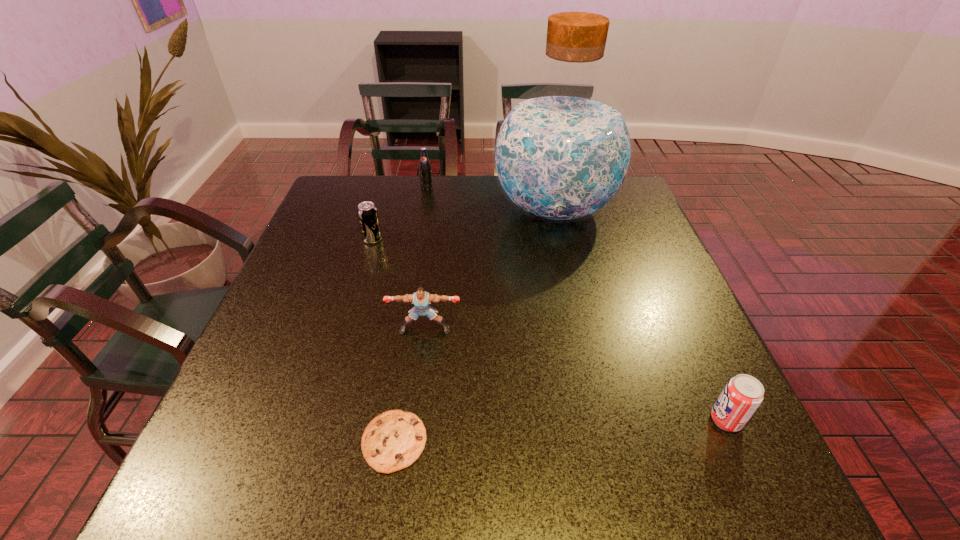
Identify the location of water jug. The image size is (960, 540). (562, 152).

I want to click on the tallest object, so click(562, 152).

The image size is (960, 540). In order to click on the second soda can from left to right in this screenshot , I will do `click(425, 169)`.

Locate an element on the screen. The width and height of the screenshot is (960, 540). the farthest soda can is located at coordinates (425, 169).

The height and width of the screenshot is (540, 960). In order to click on puncher in this screenshot , I will do `click(421, 299)`.

Where is `the leftmost soda can`? This screenshot has width=960, height=540. the leftmost soda can is located at coordinates pyautogui.click(x=367, y=212).

Find the location of a particular element. the leftmost object is located at coordinates (367, 212).

You are a GUI agent. You are given a task and a screenshot of the screen. Output one action in this format:
    pyautogui.click(x=<x>, y=<y>)
    Task: Click on the nearest soda can
    
    Given the screenshot: What is the action you would take?
    pyautogui.click(x=742, y=395)

This screenshot has width=960, height=540. I want to click on the rightmost object, so click(742, 395).

At what (x,y) coordinates should I click in order to perform the action: click on cookie. Please return your answer as a coordinate pair (x, y). The height and width of the screenshot is (540, 960). Looking at the image, I should click on (393, 440).